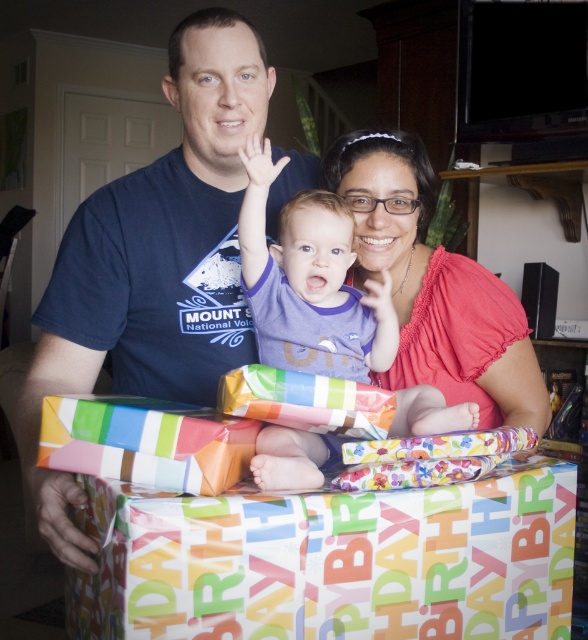
Question: Which point is closer to the camera taking this photo?

Choices:
 (A) (479, 540)
 (B) (412, 280)

Answer: (A)

Question: Which of these objects is positioned farthest from the multicolored paper gift at center?

Choices:
 (A) multicolored paper wrapped gift at lower center
 (B) matte blue t-shirt at center
 (C) purple cotton shirt at center
 (D) matte pink blouse at center

Answer: (D)

Question: Does multicolored paper gift at center appear on the right side of purple cotton shirt at center?

Choices:
 (A) yes
 (B) no

Answer: (B)

Question: Does matte blue t-shirt at center have a larger size compared to multicolored paper wrapped gift at lower center?

Choices:
 (A) no
 (B) yes

Answer: (B)

Question: Which point appears farthest from the camera in this image?

Choices:
 (A) (95, 252)
 (B) (380, 250)
 (C) (417, 396)

Answer: (B)

Question: Can you confirm if multicolored paper gift at center is thinner than matte blue t-shirt at center?

Choices:
 (A) no
 (B) yes

Answer: (B)